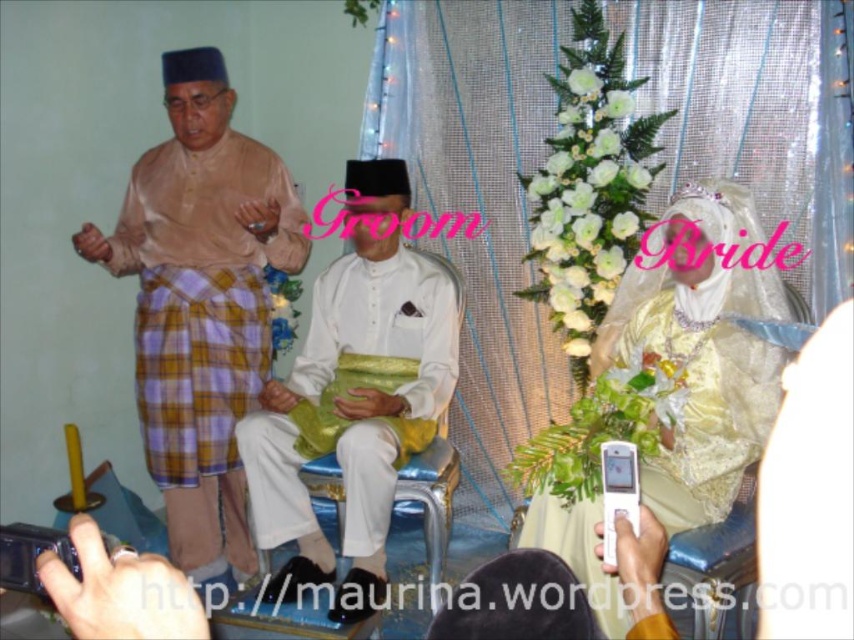
In the traditional Malay wedding scene, there are two shirts visible. The matte brown shirt at left and the white satin shirt at center. Which shirt is positioned more to the left side of the image?

The matte brown shirt at left is positioned more to the left side of the image than the white satin shirt at center.

You are a photographer at a wedding and need to capture a closeup shot of both the white satin shirt at center and the white satin dress at upper right. The camera you are using has a maximum focus range of 30 inches. Can you fit both subjects within the camera focus range?

The white satin shirt at center and the white satin dress at upper right are 29.27 inches apart, which is within the camera focus range of 30 inches. Yes, both subjects can be captured in the same shot.